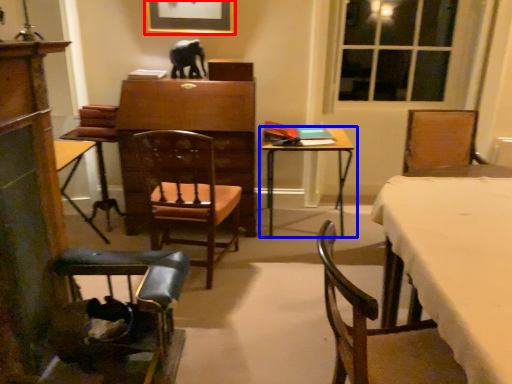
Question: Which object is further to the camera taking this photo, picture frame (highlighted by a red box) or table (highlighted by a blue box)?

Choices:
 (A) picture frame
 (B) table

Answer: (A)